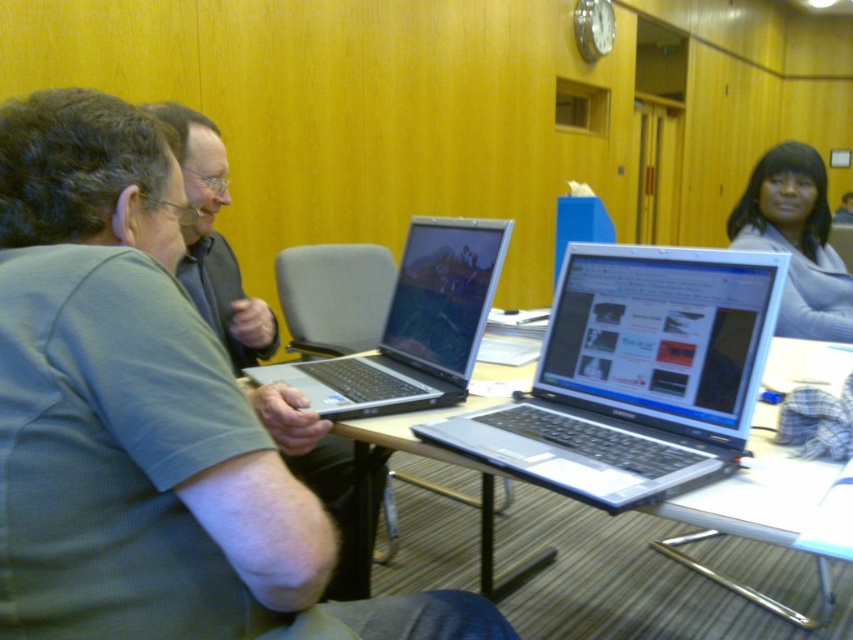
Question: Considering the relative positions of silver metallic table at center and light blue sweater at upper right in the image provided, where is silver metallic table at center located with respect to light blue sweater at upper right?

Choices:
 (A) below
 (B) above

Answer: (A)

Question: Based on their relative distances, which object is farther from the light blue sweater at upper right?

Choices:
 (A) silver metallic laptop at center
 (B) matte gray shirt at left
 (C) silver/black laptop at center

Answer: (B)

Question: Does silver metallic laptop at center lie in front of matte gray shirt at left?

Choices:
 (A) no
 (B) yes

Answer: (B)

Question: Is silver metallic table at center closer to camera compared to matte gray shirt at left?

Choices:
 (A) yes
 (B) no

Answer: (B)

Question: Which of the following is the farthest from the observer?

Choices:
 (A) (306, 456)
 (B) (306, 388)
 (C) (705, 260)
 (D) (788, 493)

Answer: (A)

Question: Which point appears closest to the camera in this image?

Choices:
 (A) (418, 435)
 (B) (204, 196)
 (C) (358, 433)

Answer: (A)